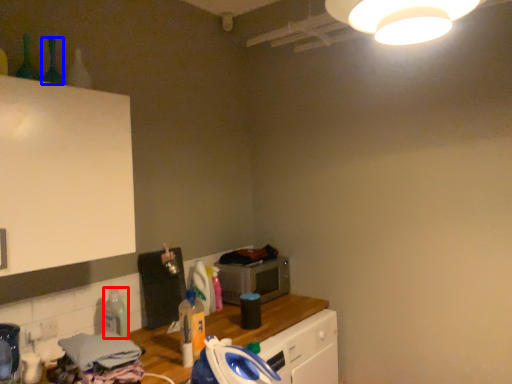
Question: Which point is closer to the camera, bottle (highlighted by a red box) or bottle (highlighted by a blue box)?

Choices:
 (A) bottle
 (B) bottle

Answer: (B)